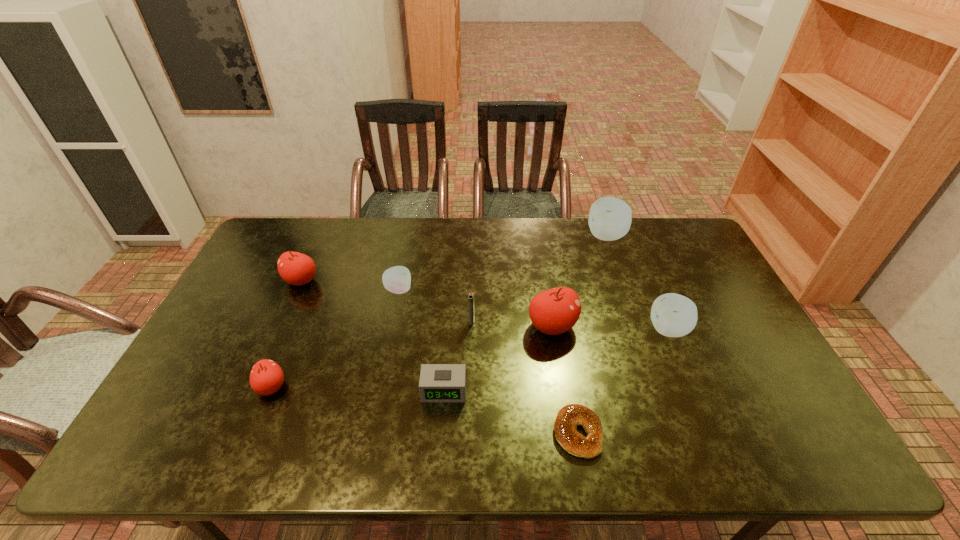
You are a GUI agent. You are given a task and a screenshot of the screen. Output one action in this format:
    pyautogui.click(x=<x>, y=<y>)
    Task: Click on the free space located 0.210m on the left of the seventh object from right to left
    The image size is (960, 540).
    Given the screenshot: What is the action you would take?
    pyautogui.click(x=319, y=290)

Locate an element on the screen. The height and width of the screenshot is (540, 960). free space located on the front of the smallest red apple is located at coordinates (253, 432).

Locate an element on the screen. This screenshot has width=960, height=540. free space located on the front-facing side of the second shortest object is located at coordinates (441, 441).

You are a GUI agent. You are given a task and a screenshot of the screen. Output one action in this format:
    pyautogui.click(x=<x>, y=<y>)
    Task: Click on the free spot located on the left of the bagel
    The width and height of the screenshot is (960, 540).
    Given the screenshot: What is the action you would take?
    pyautogui.click(x=421, y=433)

You are a GUI agent. You are given a task and a screenshot of the screen. Output one action in this format:
    pyautogui.click(x=<x>, y=<y>)
    Task: Click on the object situated at the far edge
    The width and height of the screenshot is (960, 540).
    Given the screenshot: What is the action you would take?
    pyautogui.click(x=610, y=218)

The height and width of the screenshot is (540, 960). Identify the location of object positioned at the near edge. (570, 416).

I want to click on object located in the left edge section of the desktop, so click(295, 268).

Find the location of a particular element. free region at the far edge of the desktop is located at coordinates (624, 258).

Identify the location of vacant area at the near edge of the desktop. The width and height of the screenshot is (960, 540). (522, 430).

The height and width of the screenshot is (540, 960). I want to click on free space at the right edge, so click(x=703, y=342).